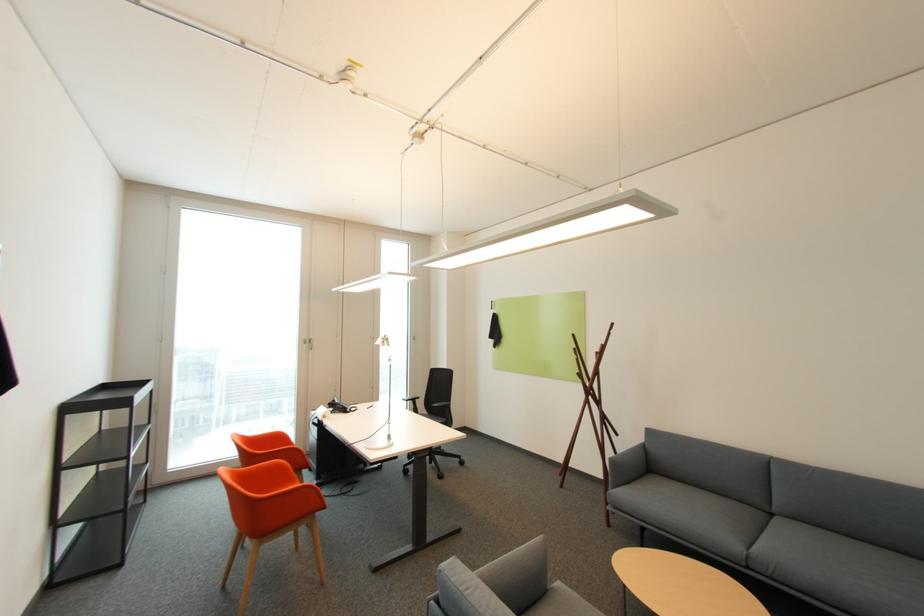
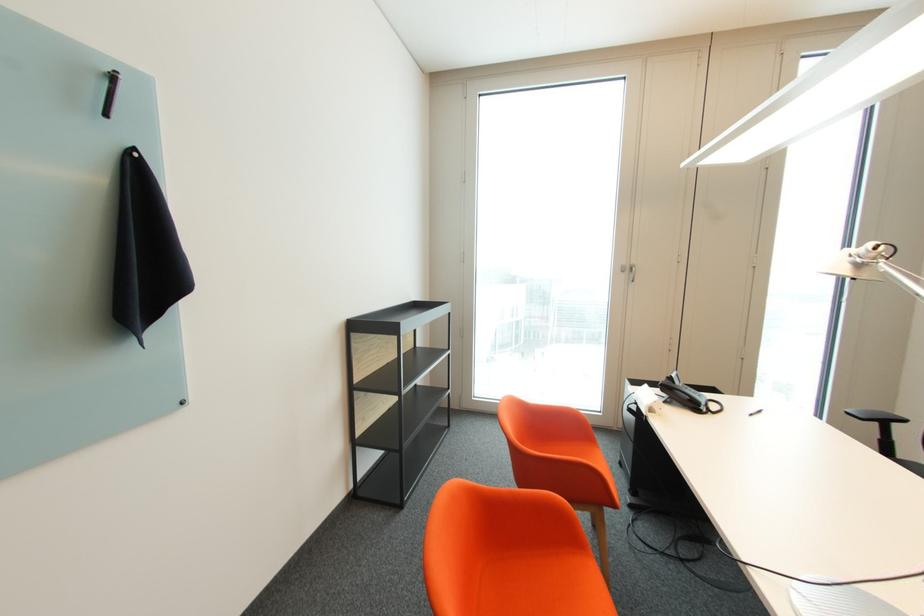
Locate, in the second image, the point that corresponds to (310,342) in the first image.

(629, 272)